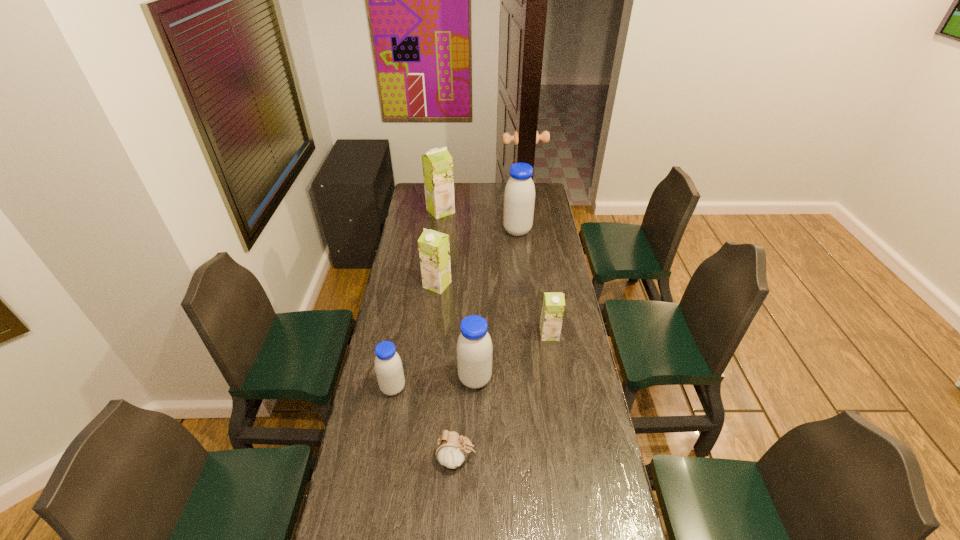
Image resolution: width=960 pixels, height=540 pixels. Identify the location of the biggest green soya milk. (437, 163).

You are a GUI agent. You are given a task and a screenshot of the screen. Output one action in this format:
    pyautogui.click(x=<x>, y=<y>)
    Task: Click on the farthest green soya milk
    
    Given the screenshot: What is the action you would take?
    coord(437,163)

The width and height of the screenshot is (960, 540). What are the coordinates of `the farthest blue soya milk` in the screenshot? It's located at (519, 196).

Find the location of `the sixth nearest object`. the sixth nearest object is located at coordinates (519, 196).

The width and height of the screenshot is (960, 540). Find the location of `the third farthest soya milk`. the third farthest soya milk is located at coordinates (434, 250).

The width and height of the screenshot is (960, 540). In order to click on the second nearest green soya milk in this screenshot , I will do `click(434, 250)`.

At what (x,y) coordinates should I click in order to perform the action: click on the second smallest blue soya milk. Please return your answer as a coordinate pair (x, y). Looking at the image, I should click on (474, 348).

Find the location of `the second blue soya milk from right to left`. the second blue soya milk from right to left is located at coordinates (474, 348).

Identify the location of the rightmost green soya milk. The image size is (960, 540). [553, 306].

I want to click on the nearest green soya milk, so click(x=553, y=306).